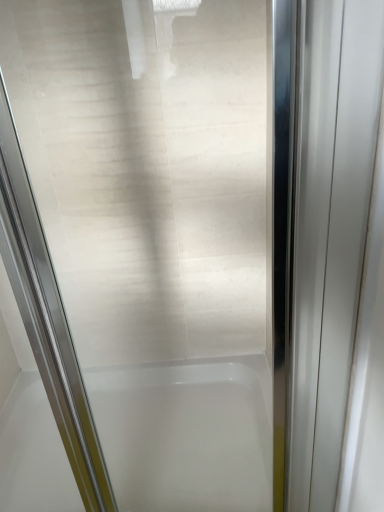
The height and width of the screenshot is (512, 384). Describe the element at coordinates (187, 434) in the screenshot. I see `white glossy bathtub at center` at that location.

What is the approximate height of white glossy bathtub at center?

white glossy bathtub at center is 20.57 centimeters tall.

Identify the location of white glossy bathtub at center. (187, 434).

What do you see at coordinates (328, 230) in the screenshot?
I see `polished chrome elevator door at right` at bounding box center [328, 230].

The height and width of the screenshot is (512, 384). In order to click on polished chrome elevator door at right in this screenshot , I will do `click(328, 230)`.

You are a GUI agent. You are given a task and a screenshot of the screen. Output one action in this format:
    pyautogui.click(x=<x>, y=<y>)
    Task: Click on the white glossy bathtub at center
    
    Given the screenshot: What is the action you would take?
    pyautogui.click(x=187, y=434)

Consider the image. Considering the relative positions of polished chrome elevator door at right and white glossy bathtub at center in the image provided, is polished chrome elevator door at right to the left of white glossy bathtub at center from the viewer's perspective?

Incorrect, polished chrome elevator door at right is not on the left side of white glossy bathtub at center.

Is the depth of polished chrome elevator door at right greater than that of white glossy bathtub at center?

No, polished chrome elevator door at right is in front of white glossy bathtub at center.

Which point is more forward, (345,138) or (36,385)?

The point (345,138) is in front.

From the image's perspective, is polished chrome elevator door at right beneath white glossy bathtub at center?

Incorrect, from the image's perspective, polished chrome elevator door at right is higher than white glossy bathtub at center.

From a real-world perspective, is polished chrome elevator door at right below white glossy bathtub at center?

No, from a real-world perspective, polished chrome elevator door at right is not below white glossy bathtub at center.

Can you confirm if polished chrome elevator door at right is thinner than white glossy bathtub at center?

Yes.

Does polished chrome elevator door at right have a greater height compared to white glossy bathtub at center?

Correct, polished chrome elevator door at right is much taller as white glossy bathtub at center.

Considering the sizes of polished chrome elevator door at right and white glossy bathtub at center in the image, is polished chrome elevator door at right bigger or smaller than white glossy bathtub at center?

Considering their sizes, polished chrome elevator door at right takes up less space than white glossy bathtub at center.

Is polished chrome elevator door at right located outside white glossy bathtub at center?

Indeed, polished chrome elevator door at right is completely outside white glossy bathtub at center.

Are polished chrome elevator door at right and white glossy bathtub at center far apart?

No, polished chrome elevator door at right is not far away from white glossy bathtub at center.

Does polished chrome elevator door at right turn towards white glossy bathtub at center?

Yes, polished chrome elevator door at right is oriented towards white glossy bathtub at center.

What's the angular difference between polished chrome elevator door at right and white glossy bathtub at center's facing directions?

polished chrome elevator door at right and white glossy bathtub at center are facing 89.8 degrees away from each other.

At what (x,y) coordinates should I click in order to perform the action: click on bathtub below the polished chrome elevator door at right (from the image's perspective). Please return your answer as a coordinate pair (x, y). The image size is (384, 512). Looking at the image, I should click on (187, 434).

Is white glossy bathtub at center at the left side of polished chrome elevator door at right?

Indeed, white glossy bathtub at center is positioned on the left side of polished chrome elevator door at right.

Does white glossy bathtub at center come in front of polished chrome elevator door at right?

No, it is behind polished chrome elevator door at right.

Is point (37, 405) behind point (383, 58)?

Yes, point (37, 405) is farther from viewer.

Consider the image. From the image's perspective, who appears lower, white glossy bathtub at center or polished chrome elevator door at right?

white glossy bathtub at center is shown below in the image.

From a real-world perspective, is white glossy bathtub at center below polished chrome elevator door at right?

Yes, from a real-world perspective, white glossy bathtub at center is under polished chrome elevator door at right.

Consider the image. Which object is wider, white glossy bathtub at center or polished chrome elevator door at right?

white glossy bathtub at center.

Between white glossy bathtub at center and polished chrome elevator door at right, which one has more height?

Standing taller between the two is polished chrome elevator door at right.

Does white glossy bathtub at center have a larger size compared to polished chrome elevator door at right?

Yes, white glossy bathtub at center is bigger than polished chrome elevator door at right.

Does white glossy bathtub at center contain polished chrome elevator door at right?

No, white glossy bathtub at center does not contain polished chrome elevator door at right.

Is white glossy bathtub at center far from polished chrome elevator door at right?

No, there isn't a large distance between white glossy bathtub at center and polished chrome elevator door at right.

Is white glossy bathtub at center facing away from polished chrome elevator door at right?

No, white glossy bathtub at center is not facing away from polished chrome elevator door at right.

Looking at this image, how different are the orientations of white glossy bathtub at center and polished chrome elevator door at right in degrees?

There is a 89.8-degree angle between the facing directions of white glossy bathtub at center and polished chrome elevator door at right.

Identify the location of elevator door in front of the white glossy bathtub at center. Image resolution: width=384 pixels, height=512 pixels. (328, 230).

I want to click on bathtub behind the polished chrome elevator door at right, so point(187,434).

Image resolution: width=384 pixels, height=512 pixels. I want to click on bathtub on the left of polished chrome elevator door at right, so click(187, 434).